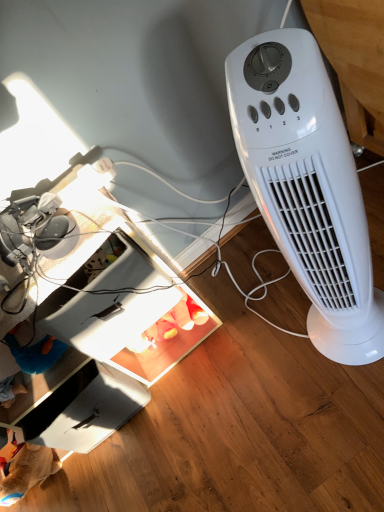
The height and width of the screenshot is (512, 384). What are the coordinates of `empty space that is to the right of white cardboard drawer at lower left` in the screenshot? It's located at (183, 380).